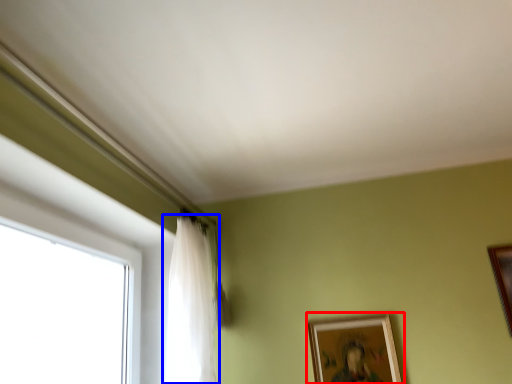
Question: Which object appears farthest to the camera in this image, picture frame (highlighted by a red box) or curtain (highlighted by a blue box)?

Choices:
 (A) picture frame
 (B) curtain

Answer: (A)